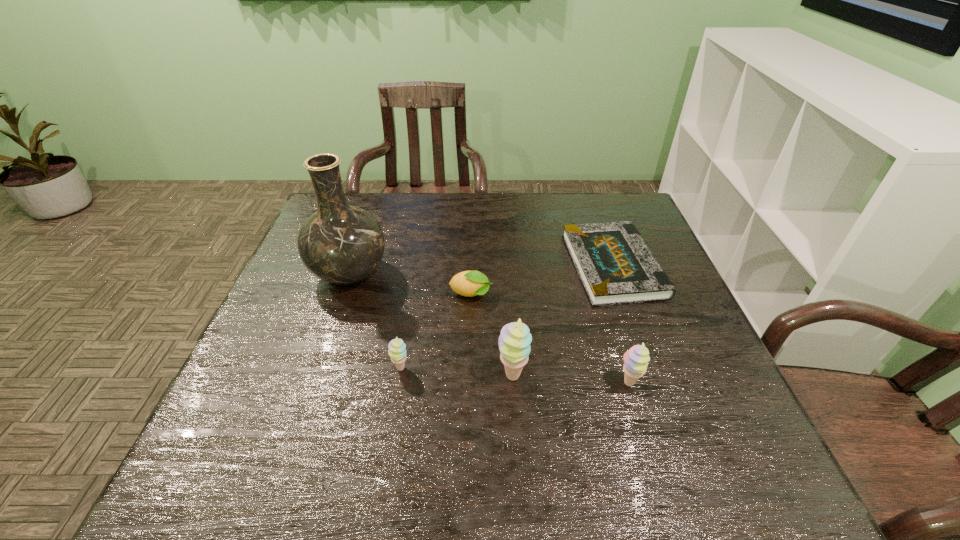
Identify the location of vase. (342, 244).

Locate an element on the screen. Image resolution: width=960 pixels, height=540 pixels. vacant region located 0.070m on the left of the fifth object from right to left is located at coordinates (360, 368).

Where is `vacant space located on the right of the third object from right to left`? The height and width of the screenshot is (540, 960). vacant space located on the right of the third object from right to left is located at coordinates (705, 376).

You are a GUI agent. You are given a task and a screenshot of the screen. Output one action in this format:
    pyautogui.click(x=<x>, y=<y>)
    Task: Click on the free region located 0.080m on the front of the second tallest sherbert
    
    Given the screenshot: What is the action you would take?
    pyautogui.click(x=641, y=429)

The height and width of the screenshot is (540, 960). Find the location of `free space located 0.170m with leaves positioned above the second shortest object`. free space located 0.170m with leaves positioned above the second shortest object is located at coordinates (559, 295).

The width and height of the screenshot is (960, 540). Find the location of `vacant space situated 0.200m on the back of the shortest object`. vacant space situated 0.200m on the back of the shortest object is located at coordinates (588, 198).

Where is `free space located on the front of the tallest object`? This screenshot has height=540, width=960. free space located on the front of the tallest object is located at coordinates (327, 341).

Where is `object at the far edge`? object at the far edge is located at coordinates (615, 265).

The height and width of the screenshot is (540, 960). What are the coordinates of `object located in the left edge section of the desktop` in the screenshot? It's located at 342,244.

In order to click on object that is at the right edge in this screenshot , I will do `click(615, 265)`.